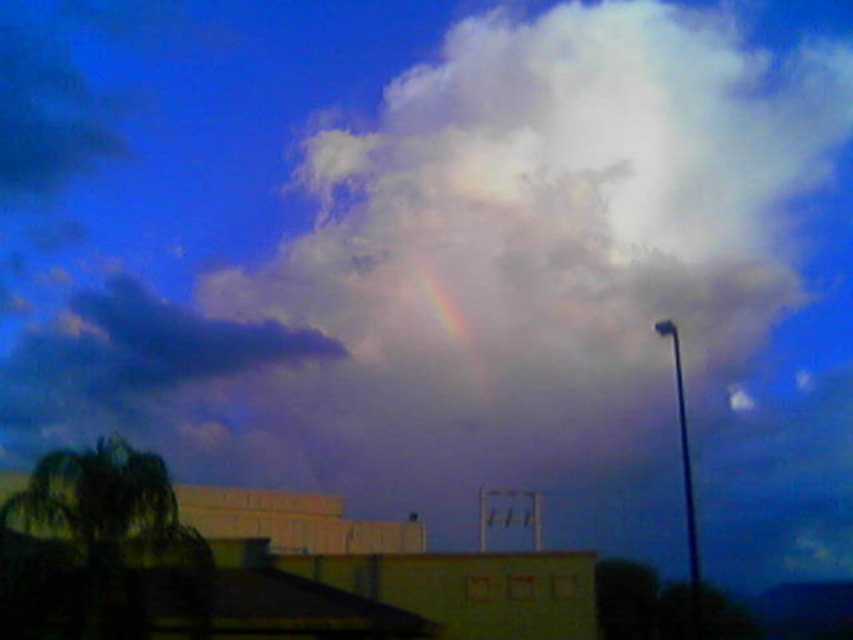
You are standing in a park and see the green leafy palm tree at lower left and the rainbow at upper center. Which object is nearer to you?

The green leafy palm tree at lower left is closer to the viewer than the rainbow at upper center.

You are standing in a park and see the green leafy palm tree at lower left and the rainbow at upper center. Which object is wider?

The rainbow at upper center is wider than the green leafy palm tree at lower left.